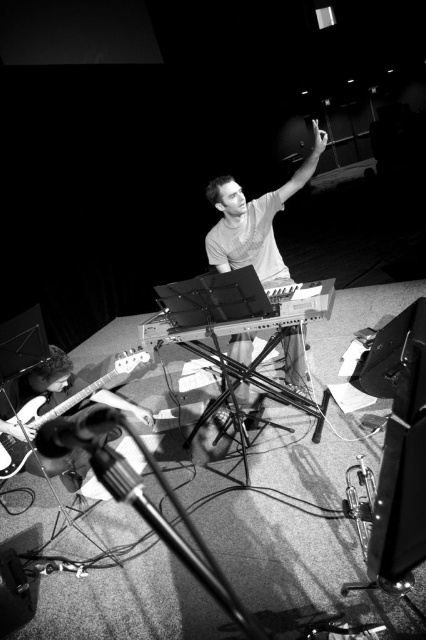
Question: Is matte gray shirt at center below metallic electric guitar at lower left?

Choices:
 (A) yes
 (B) no

Answer: (B)

Question: Is matte gray shirt at center further to camera compared to metallic silver microphone at lower left?

Choices:
 (A) no
 (B) yes

Answer: (A)

Question: Estimate the real-world distances between objects in this image. Which object is farther from the metallic silver microphone at lower left?

Choices:
 (A) metallic electric guitar at lower left
 (B) matte gray shirt at center

Answer: (B)

Question: Is matte gray shirt at center to the left of metallic silver microphone at lower left from the viewer's perspective?

Choices:
 (A) no
 (B) yes

Answer: (A)

Question: Among these objects, which one is nearest to the camera?

Choices:
 (A) matte gray shirt at center
 (B) metallic silver microphone at lower left

Answer: (A)

Question: Which object appears closest to the camera in this image?

Choices:
 (A) metallic silver microphone at lower left
 (B) matte gray shirt at center
 (C) metallic electric guitar at lower left

Answer: (C)